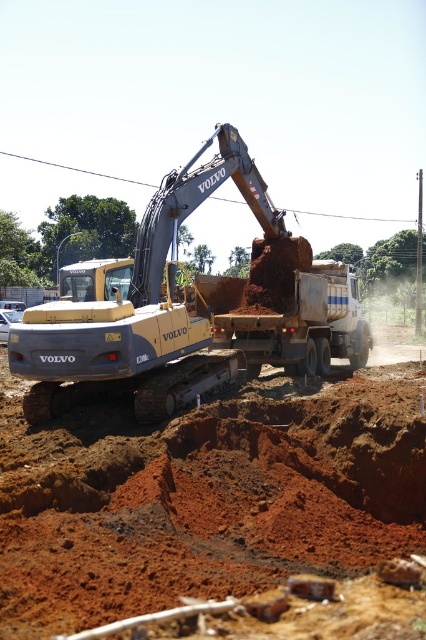
You are a construction supervisor checking the site layout. You need to determine if the yellow metallic excavator at center can be moved to the storage area located behind the brown clay trailer truck at center. Considering their sizes, will the excavator fit through the space available behind the truck?

The yellow metallic excavator at center is larger in size than the brown clay trailer truck at center. Therefore, it may not fit through the space available behind the truck unless the area is sufficiently spacious to accommodate its dimensions.

You are an operator on the yellow metallic excavator at center. You need to dump the bucket load into the brown clay trailer truck at center. Can you do this without moving the excavator?

The yellow metallic excavator at center is above the brown clay trailer truck at center, so yes, the operator can dump the bucket load into the brown clay trailer truck at center without moving the excavator since it is positioned higher.